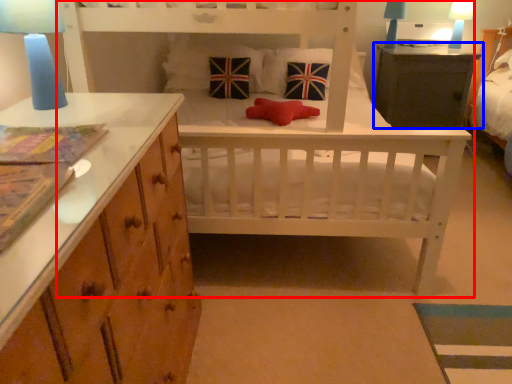
Question: Among these objects, which one is nearest to the camera, infant bed (highlighted by a red box) or table (highlighted by a blue box)?

Choices:
 (A) infant bed
 (B) table

Answer: (A)